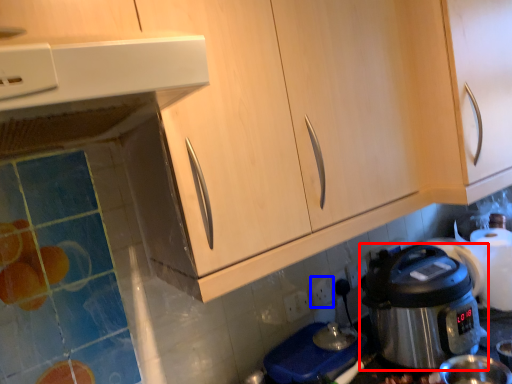
Question: Which of the following is the farthest to the observer, rice cooker (highlighted by a red box) or electric outlet (highlighted by a blue box)?

Choices:
 (A) rice cooker
 (B) electric outlet

Answer: (B)